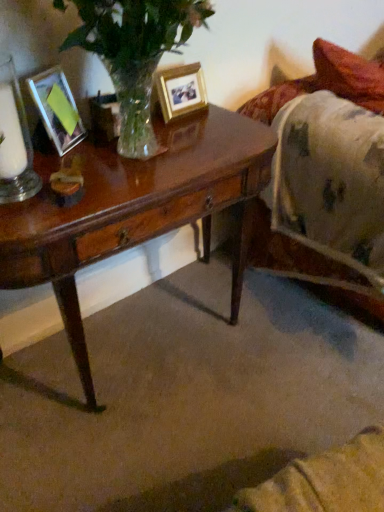
Find the location of a particular element. This screenshot has width=384, height=512. blank space situated above shiny brown wood desk at center (from a real-world perspective) is located at coordinates (130, 153).